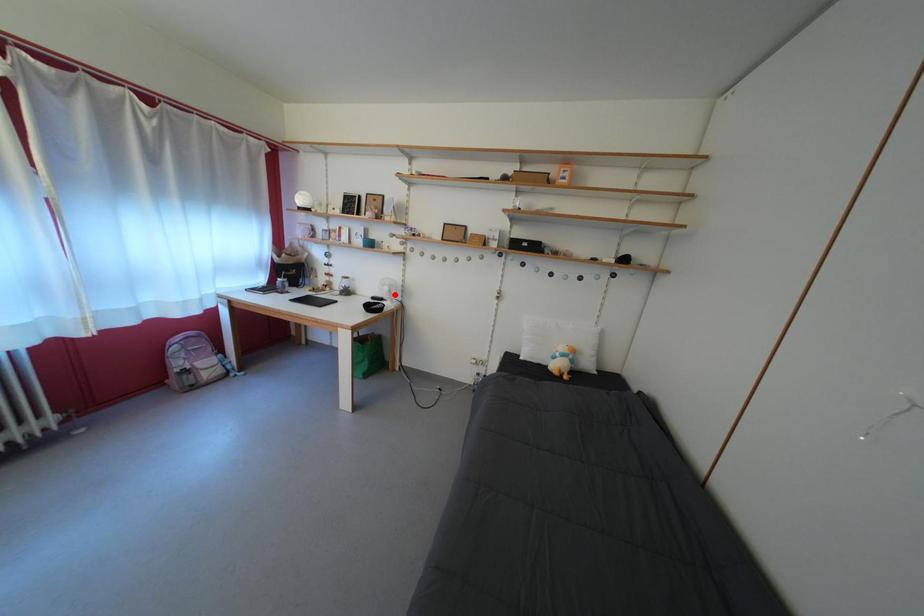
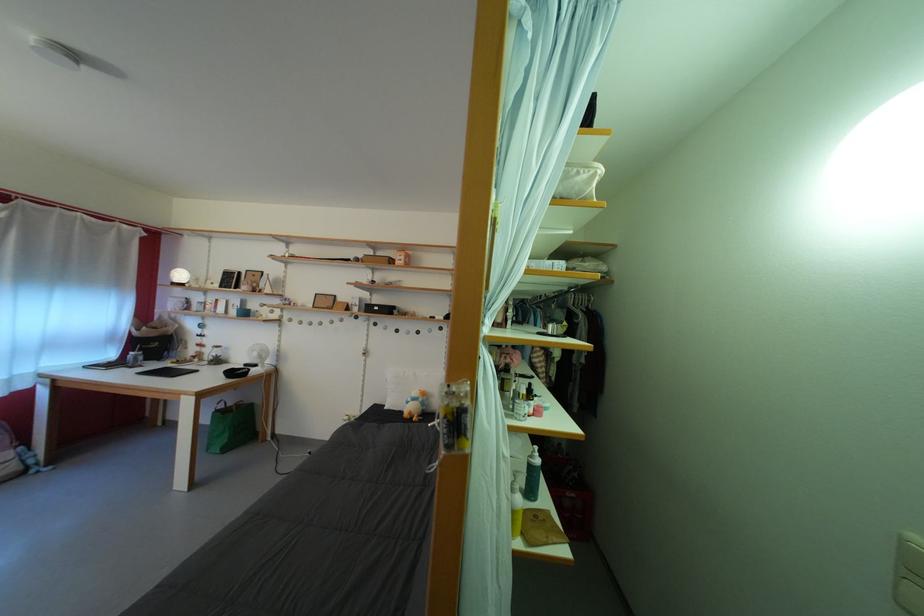
Question: I am providing you with two images of the same scene from different viewpoints. Given a red point in image1, look at the same physical point in image2. Is it:

Choices:
 (A) Closer to the viewpoint
 (B) Farther from the viewpoint

Answer: (B)